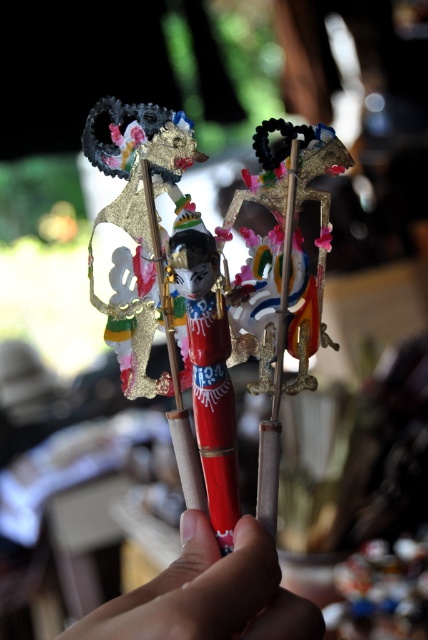
Question: Which point appears closest to the camera in this image?

Choices:
 (A) (214, 552)
 (B) (232, 288)

Answer: (A)

Question: Is smooth skin hand at center to the right of gold metallic puppet at center from the viewer's perspective?

Choices:
 (A) no
 (B) yes

Answer: (A)

Question: Which point is closer to the camera?

Choices:
 (A) (166, 602)
 (B) (294, 170)

Answer: (A)

Question: Can you confirm if smooth skin hand at center is positioned to the left of shiny red pen at center?

Choices:
 (A) no
 (B) yes

Answer: (A)

Question: Can you confirm if gold metallic puppet at center is positioned above shiny red pen at center?

Choices:
 (A) yes
 (B) no

Answer: (A)

Question: Which object is the closest to the smooth skin hand at center?

Choices:
 (A) gold metallic puppet at center
 (B) shiny red pen at center

Answer: (B)